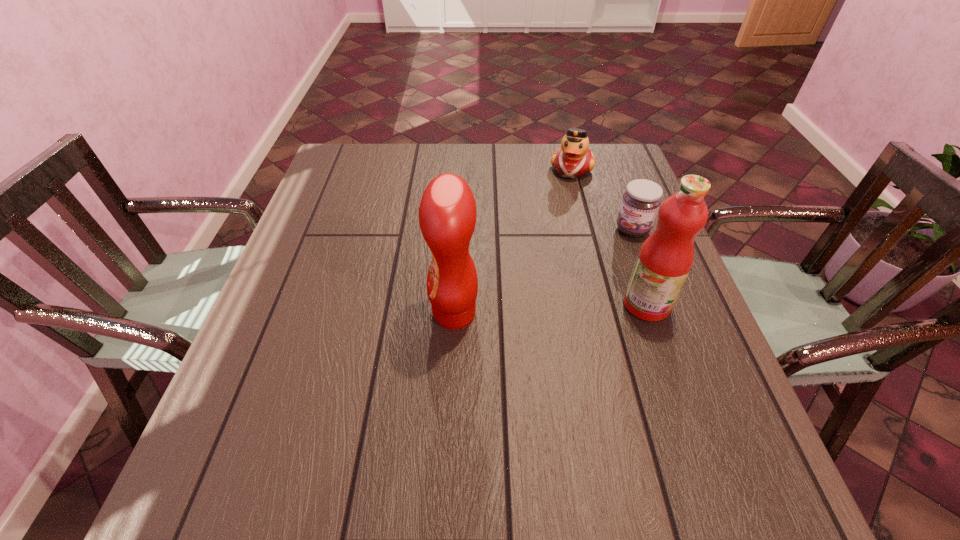
Where is `the leftmost object`? Image resolution: width=960 pixels, height=540 pixels. the leftmost object is located at coordinates (447, 214).

Locate an element on the screen. Image resolution: width=960 pixels, height=540 pixels. fruit juice is located at coordinates (665, 259).

This screenshot has width=960, height=540. In order to click on the second farthest object in this screenshot , I will do click(640, 203).

Identify the location of duck. (573, 159).

This screenshot has width=960, height=540. In order to click on free point located 0.090m on the label side of the leftmost object in this screenshot , I will do `click(389, 313)`.

Identify the location of blank area located 0.170m on the label side of the leftmost object. (351, 313).

Find the location of a particular element. Image resolution: width=960 pixels, height=540 pixels. free space located on the label side of the leftmost object is located at coordinates (314, 313).

Where is `free spot located on the front label of the jam`? free spot located on the front label of the jam is located at coordinates (607, 257).

You are a GUI agent. You are given a task and a screenshot of the screen. Output one action in this format:
    pyautogui.click(x=<x>, y=<y>)
    Task: Click on the free space located on the front label of the jam
    The width and height of the screenshot is (960, 540).
    Given the screenshot: What is the action you would take?
    pyautogui.click(x=554, y=314)

Image resolution: width=960 pixels, height=540 pixels. In order to click on free region located on the front label of the jam in this screenshot , I will do `click(571, 295)`.